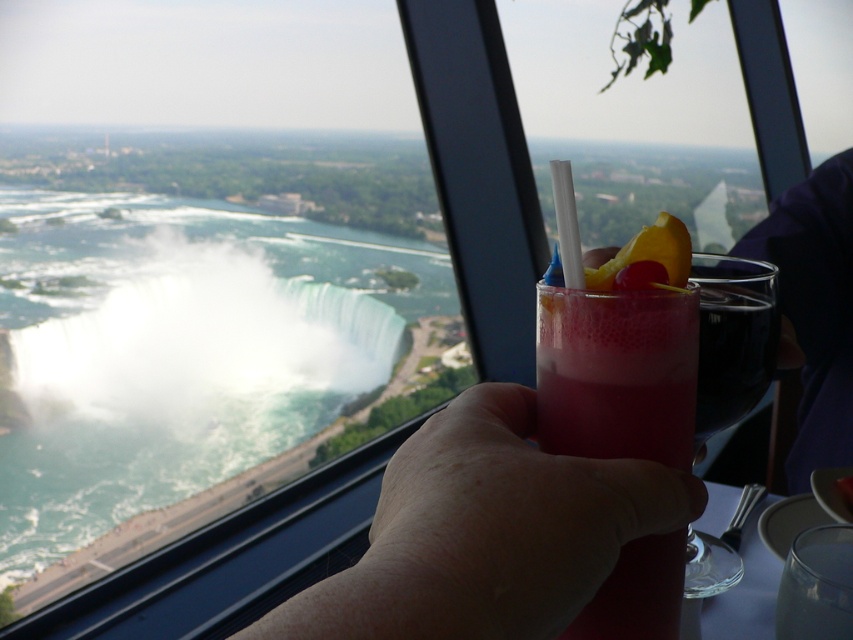
Is white misty waterfall at center smaller than pink translucent glass at center?

No.

In order to click on white misty waterfall at center in this screenshot , I will do `click(206, 337)`.

Locate an element on the screen. The height and width of the screenshot is (640, 853). white misty waterfall at center is located at coordinates coord(206,337).

Is white misty waterfall at center shorter than pink frothy drink at center?

No.

Who is higher up, white misty waterfall at center or pink frothy drink at center?

Positioned higher is white misty waterfall at center.

Between point (125, 360) and point (772, 284), which one is positioned behind?

Point (125, 360)

Find the location of a particular element. white misty waterfall at center is located at coordinates (206, 337).

Can you confirm if white misty waterfall at center is positioned to the left of yellow rubber ring at center?

Correct, you'll find white misty waterfall at center to the left of yellow rubber ring at center.

Where is `white misty waterfall at center`? white misty waterfall at center is located at coordinates (206, 337).

At what (x,y) coordinates should I click in order to perform the action: click on white misty waterfall at center. Please return your answer as a coordinate pair (x, y). Looking at the image, I should click on (206, 337).